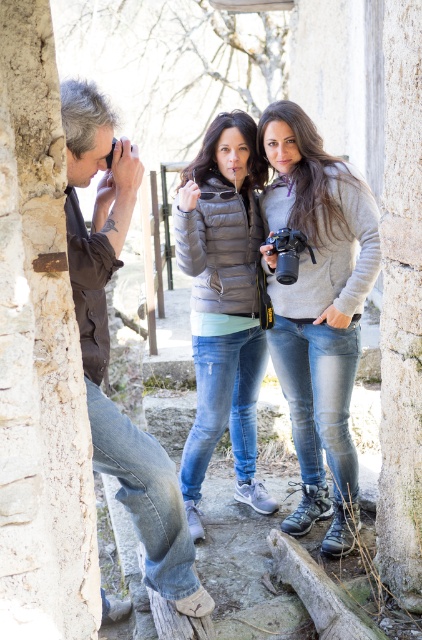
Question: Can you confirm if gray matte sweater at center is thinner than brown leather jacket at left?

Choices:
 (A) no
 (B) yes

Answer: (A)

Question: Which of the following is the farthest from the observer?

Choices:
 (A) (273, 236)
 (B) (197, 436)

Answer: (B)

Question: Which of the following is the closest to the observer?

Choices:
 (A) (324, 516)
 (B) (262, 173)

Answer: (B)

Question: Is brown leather jacket at left above black plastic camera at upper left?

Choices:
 (A) yes
 (B) no

Answer: (B)

Question: Is gray matte sweater at center to the left of brown leather jacket at left from the viewer's perspective?

Choices:
 (A) yes
 (B) no

Answer: (B)

Question: Which object is positioned closest to the matte gray puffer jacket at center?

Choices:
 (A) black plastic camera at upper left
 (B) brown leather jacket at left

Answer: (B)